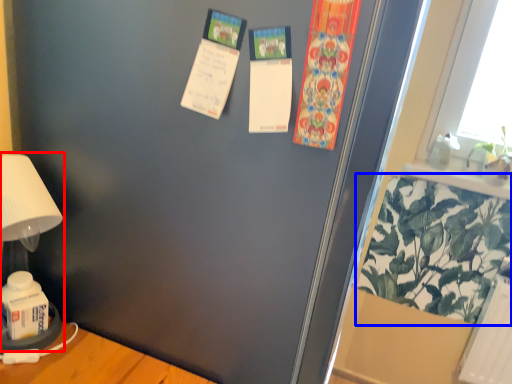
Question: Which of the following is the closest to the observer, table lamp (highlighted by a red box) or plant (highlighted by a blue box)?

Choices:
 (A) table lamp
 (B) plant

Answer: (A)